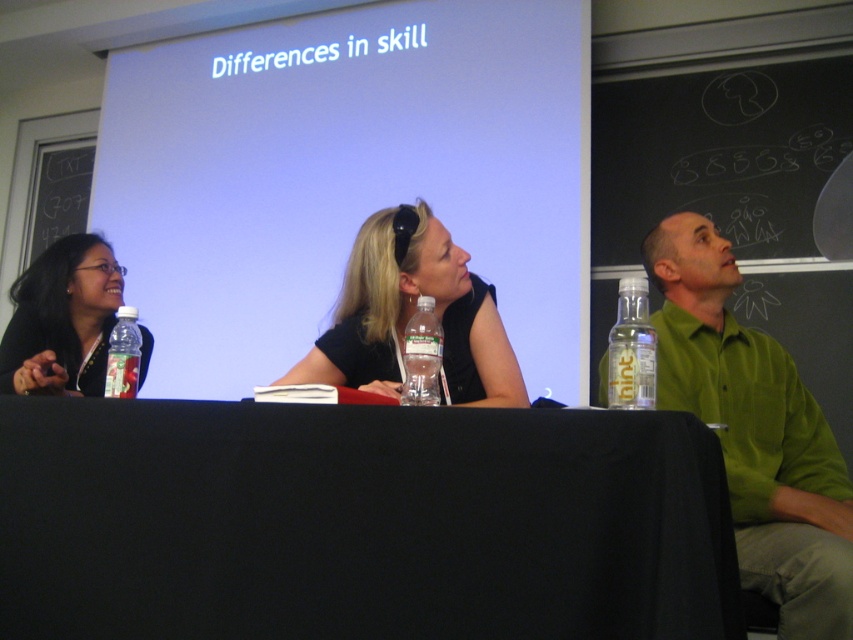
You are an attendee at the panel discussion and want to take a photo of the white matte projection screen at upper center. The screen is located at coordinates point 0.278, 0.408. If your camera has a zoom lens that can focus on objects within a 0.3 radius from the center, will you be able to capture the screen in your photo?

The white matte projection screen at upper center is located at point (347, 177). Since the camera can focus on objects within a 0.3 radius from the center, the distance from the center to the screen is sqrt. However, the exact calculation isn

You are organizing a presentation and need to choose a water bottle that can hold more liquid. Based on the image, which bottle between the clear plastic bottle at right and the translucent plastic bottle at table left should you pick?

The clear plastic bottle at right has a greater height compared to the translucent plastic bottle at table left, so you should pick the clear plastic bottle at right since it can hold more liquid.